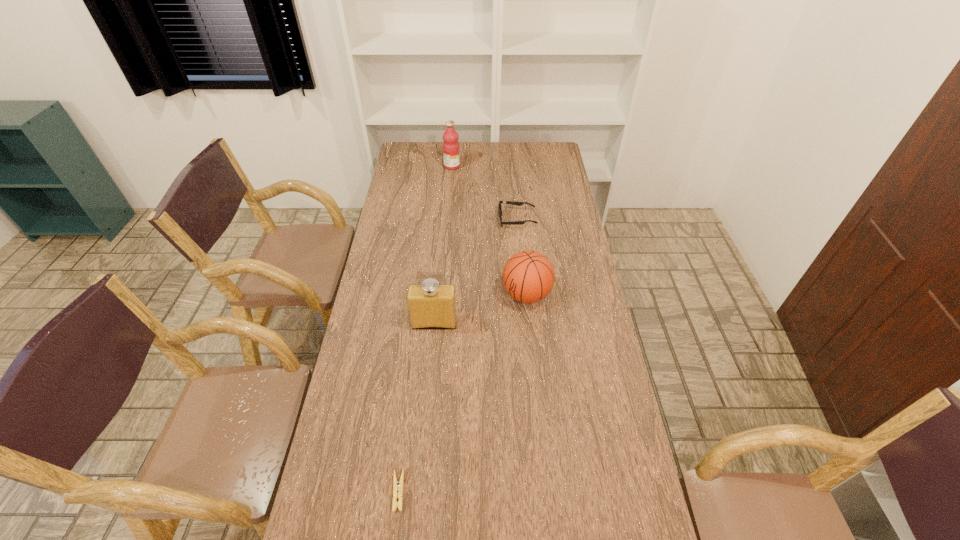
Identify the location of free space located on the left of the third tallest object. (488, 295).

You are a GUI agent. You are given a task and a screenshot of the screen. Output one action in this format:
    pyautogui.click(x=<x>, y=<y>)
    Task: Click on the free location located on the front-facing side of the sunglasses
    Image resolution: width=960 pixels, height=540 pixels.
    Given the screenshot: What is the action you would take?
    pyautogui.click(x=426, y=219)

You are a GUI agent. You are given a task and a screenshot of the screen. Output one action in this format:
    pyautogui.click(x=<x>, y=<y>)
    Task: Click on the vacant space positioned on the front-facing side of the sunglasses
    This screenshot has width=960, height=540.
    Given the screenshot: What is the action you would take?
    pyautogui.click(x=484, y=219)

The width and height of the screenshot is (960, 540). I want to click on free space located on the front-facing side of the sunglasses, so click(x=447, y=219).

At what (x,y) coordinates should I click in order to perform the action: click on vacant space located on the left of the nearest object. Please return your answer as a coordinate pair (x, y). This screenshot has width=960, height=540. Looking at the image, I should click on (349, 491).

The image size is (960, 540). Find the location of `object that is at the far edge`. object that is at the far edge is located at coordinates (451, 153).

Identify the location of object that is at the right edge. (528, 276).

I want to click on vacant space at the far edge of the desktop, so click(519, 160).

Locate an element on the screen. The width and height of the screenshot is (960, 540). vacant point at the left edge is located at coordinates (425, 188).

At what (x,y) coordinates should I click in order to perform the action: click on vacant area at the right edge. Please return your answer as a coordinate pair (x, y). This screenshot has width=960, height=540. Looking at the image, I should click on [566, 185].